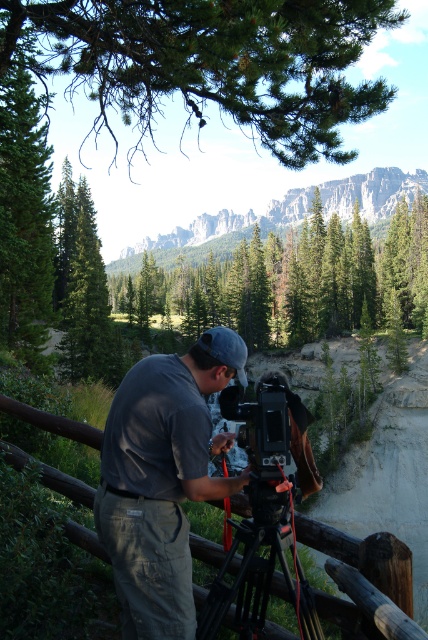
Question: Does gray cotton shirt at center appear on the left side of brown wooden fence at lower center?

Choices:
 (A) no
 (B) yes

Answer: (A)

Question: Which of these objects is positioned closest to the brown wooden fence at lower center?

Choices:
 (A) black matte camera at center
 (B) black matte tripod at center
 (C) gray cotton shirt at center

Answer: (C)

Question: Which is nearer to the black matte tripod at center?

Choices:
 (A) gray cotton shirt at center
 (B) brown wooden fence at lower center
 (C) black matte camera at center

Answer: (A)

Question: Is black matte tripod at center smaller than brown wooden fence at lower center?

Choices:
 (A) yes
 (B) no

Answer: (B)

Question: Among these objects, which one is nearest to the camera?

Choices:
 (A) brown wooden fence at lower center
 (B) gray cotton shirt at center
 (C) black matte camera at center

Answer: (C)

Question: Considering the relative positions of gray cotton shirt at center and black matte camera at center in the image provided, where is gray cotton shirt at center located with respect to black matte camera at center?

Choices:
 (A) below
 (B) above

Answer: (B)